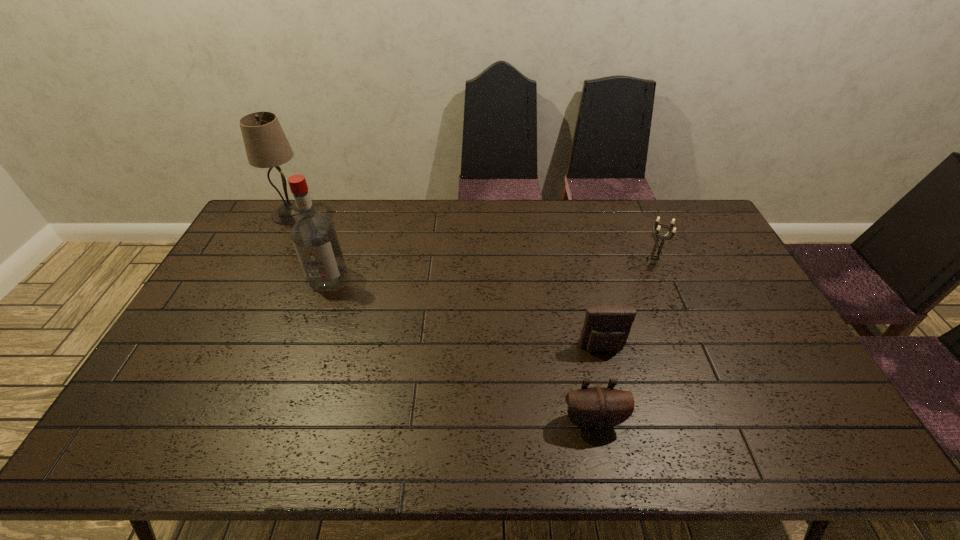
Locate an element on the screen. the farthest object is located at coordinates (266, 145).

What are the coordinates of `the leftmost object` in the screenshot? It's located at (266, 145).

Identify the location of the fourth object from right to left. The height and width of the screenshot is (540, 960). (314, 236).

Find the location of `the rightmost object`. the rightmost object is located at coordinates (654, 256).

Find the location of a particular element. The height and width of the screenshot is (540, 960). the fourth farthest object is located at coordinates (606, 328).

Find the location of a particular element. The image size is (960, 540). the nearer pouch is located at coordinates (597, 408).

You are a GUI agent. You are given a task and a screenshot of the screen. Output one action in this format:
    pyautogui.click(x=<x>, y=<y>)
    Task: Click on the free space located 0.210m on the front-facing side of the lampshade
    The image size is (960, 540).
    Given the screenshot: What is the action you would take?
    pyautogui.click(x=366, y=213)

Where is `vacant area situated on the front-facing side of the fourth object from right to left`? The height and width of the screenshot is (540, 960). vacant area situated on the front-facing side of the fourth object from right to left is located at coordinates (305, 339).

In order to click on vacant space positioned 0.080m on the left of the candle holder in this screenshot , I will do `click(618, 262)`.

In order to click on vacant space located 0.210m with an open flap on the farther pouch in this screenshot , I will do `click(621, 428)`.